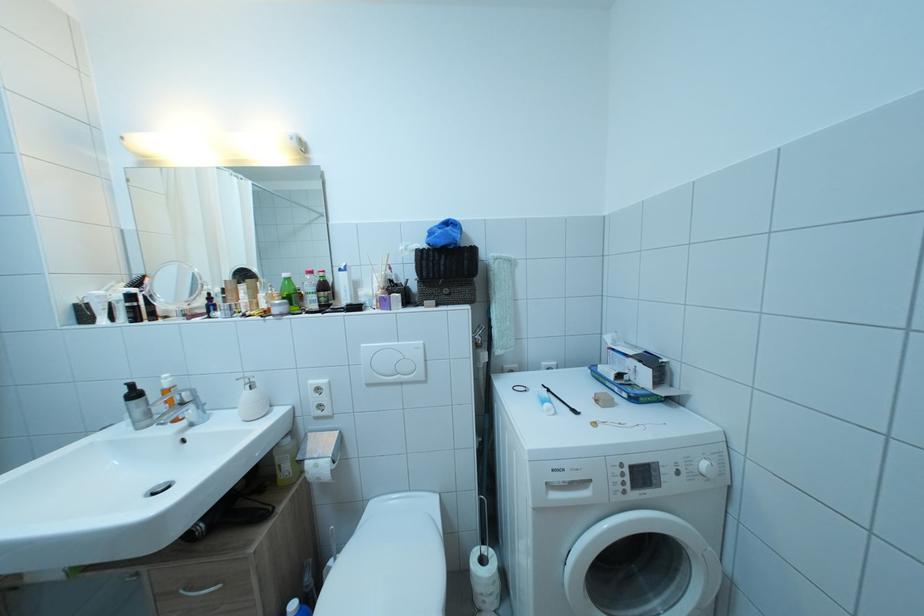
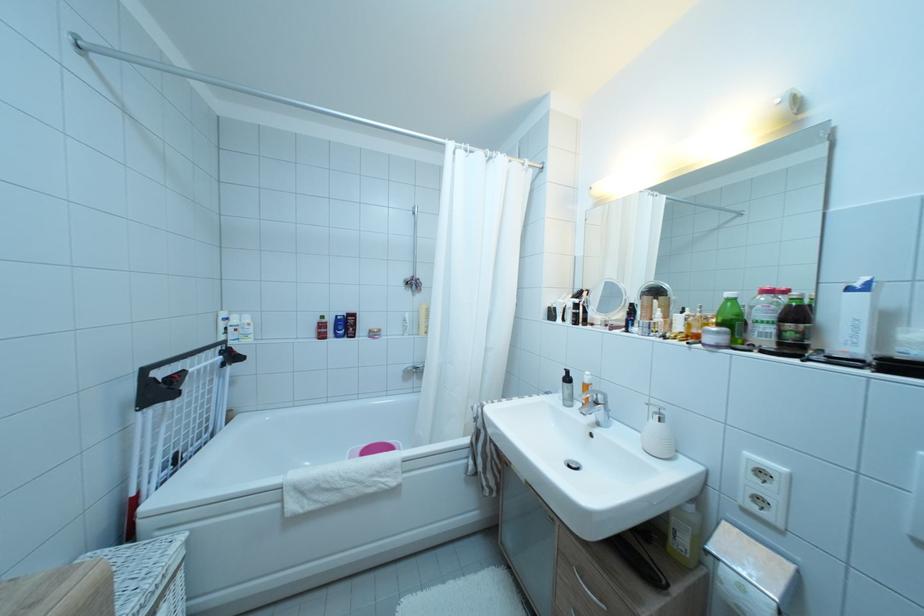
The point at (254,381) is marked in the first image. Where is the corresponding point in the second image?

(661, 407)